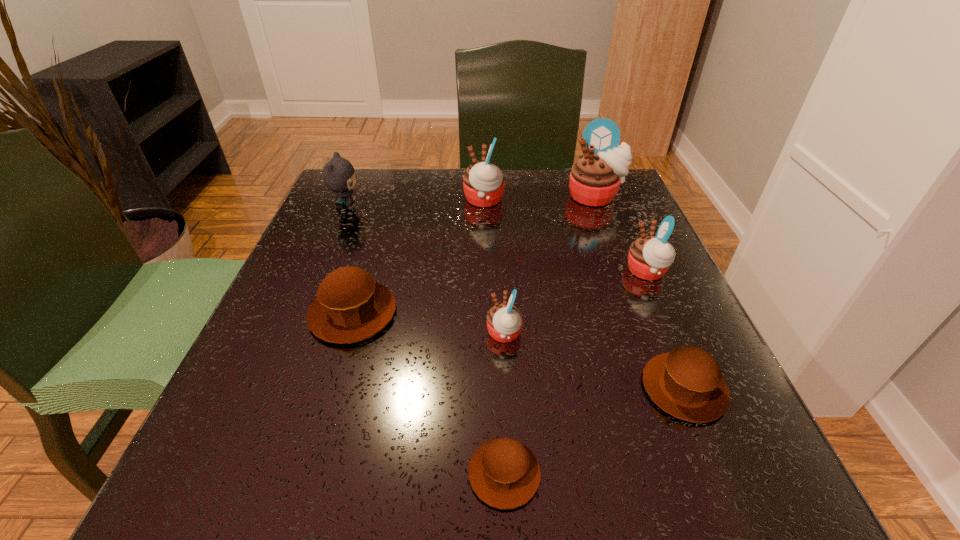
The height and width of the screenshot is (540, 960). I want to click on vacant space located on the front-facing side of the third tallest muffin, so click(506, 272).

I want to click on vacant space located on the front-facing side of the third tallest muffin, so click(600, 272).

You are a GUI agent. You are given a task and a screenshot of the screen. Output one action in this format:
    pyautogui.click(x=<x>, y=<y>)
    Task: Click on the free space located on the front-facing side of the smallest pink muffin
    
    Given the screenshot: What is the action you would take?
    tap(401, 334)

What are the coordinates of `free region located on the front-facing side of the smallest pink muffin` in the screenshot? It's located at (407, 334).

Locate an element on the screen. blank area located 0.140m on the front-facing side of the smallest pink muffin is located at coordinates (401, 334).

Where is `vacant point located 0.120m on the back of the leftmost brown muffin`? vacant point located 0.120m on the back of the leftmost brown muffin is located at coordinates 373,245.

The width and height of the screenshot is (960, 540). Identify the location of vacant space located 0.290m on the back of the sixth tallest muffin. [x=625, y=245].

Locate an element on the screen. vacant space situated 0.160m on the back of the nearest object is located at coordinates [499, 347].

Find the location of a particular element. This screenshot has width=960, height=540. kitten present at the far edge is located at coordinates (339, 176).

This screenshot has height=540, width=960. Find the location of `object that is at the near edge`. object that is at the near edge is located at coordinates (504, 473).